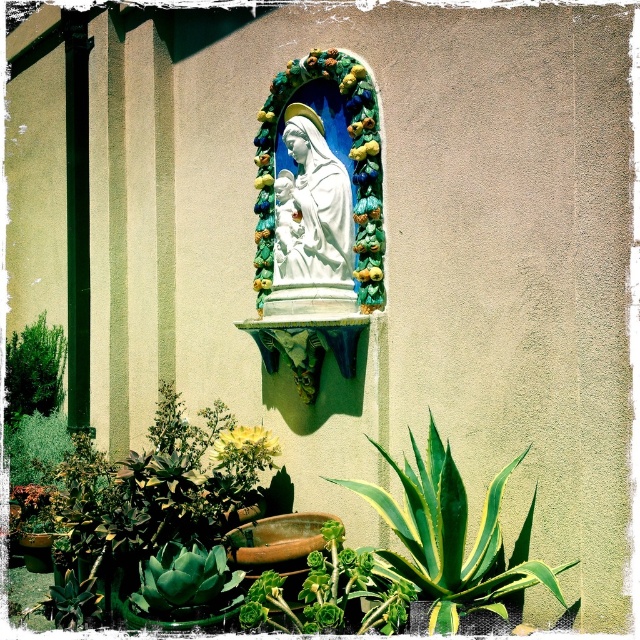
You are standing in front of the religious statue mounted on the textured beige wall. You notice a green leafy plant at lower right. Can you determine if the plant is positioned to the left or right of the statue?

The green leafy plant at lower right is located to the right of the statue.

You are a gardener looking at the religious statue scene. You need to water both the green leafy plant at lower right and the smooth red flower at lower left. Which one should you water first if you want to avoid getting water on the statue?

You should water the smooth red flower at lower left first because the green leafy plant at lower right is located above it. Watering the lower one first would prevent water from dripping onto the statue when you water the upper plant afterward.